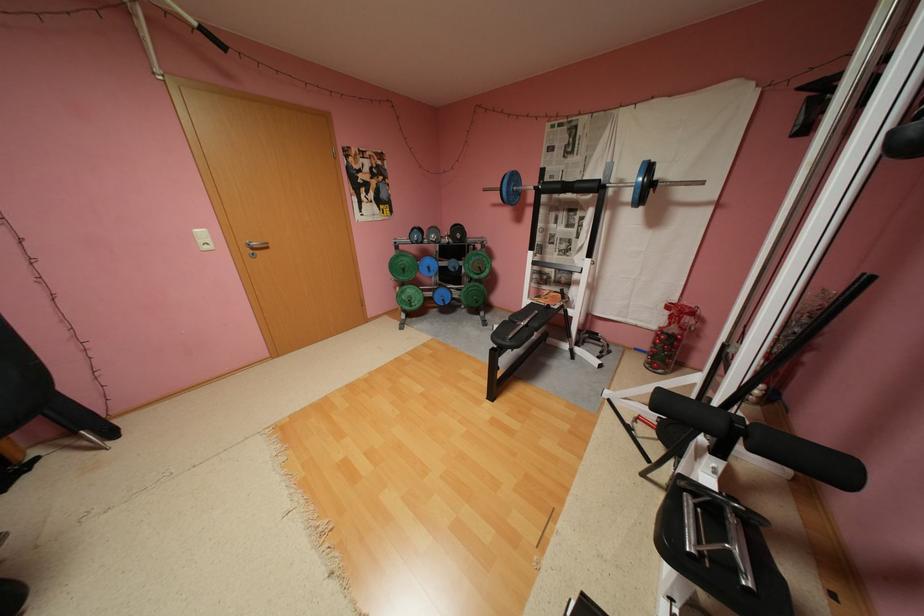
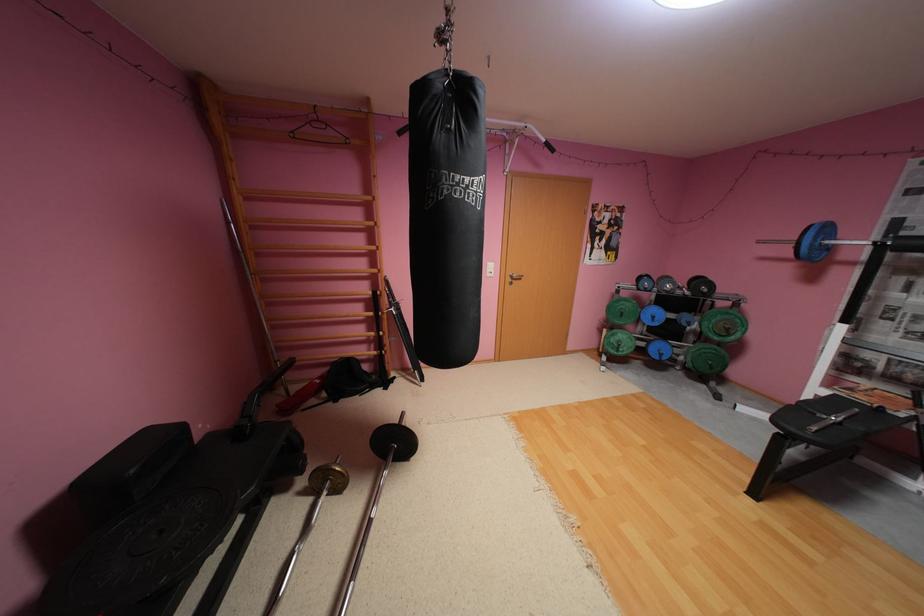
The point at (565, 307) is marked in the first image. Where is the corresponding point in the second image?

(909, 415)